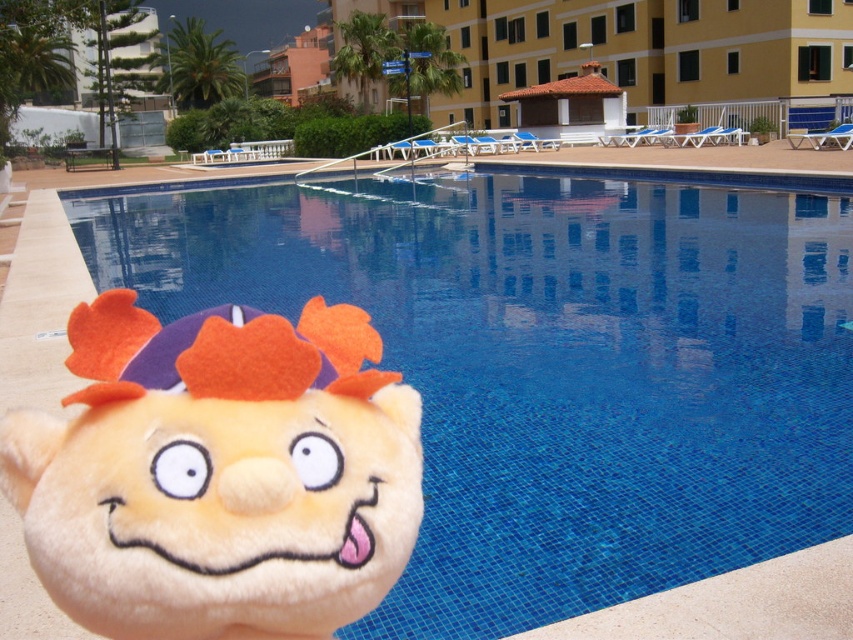
You are standing at the origin of the coordinate system in the image. You see two points, point (735, 448) and point (378, 532). Which point is closer to you?

Point (378, 532) is closer to you because it is in front of point (735, 448).

You are standing at the center of the image and want to find the blue mosaic tiles at lower left. In which direction should you look to see them?

The blue mosaic tiles at lower left are located at point coordinates that are to the lower left from your current position at the center, so you should look towards the lower left direction to see them.